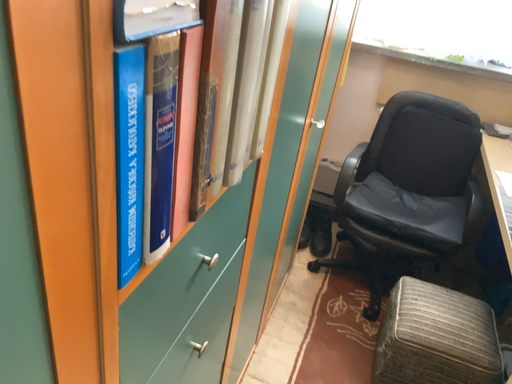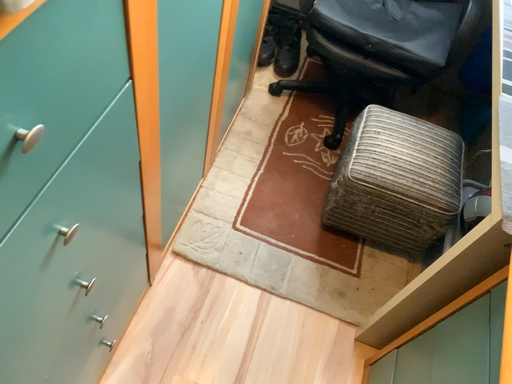
Question: Which way did the camera rotate in the video?

Choices:
 (A) rotated upward
 (B) rotated downward

Answer: (B)